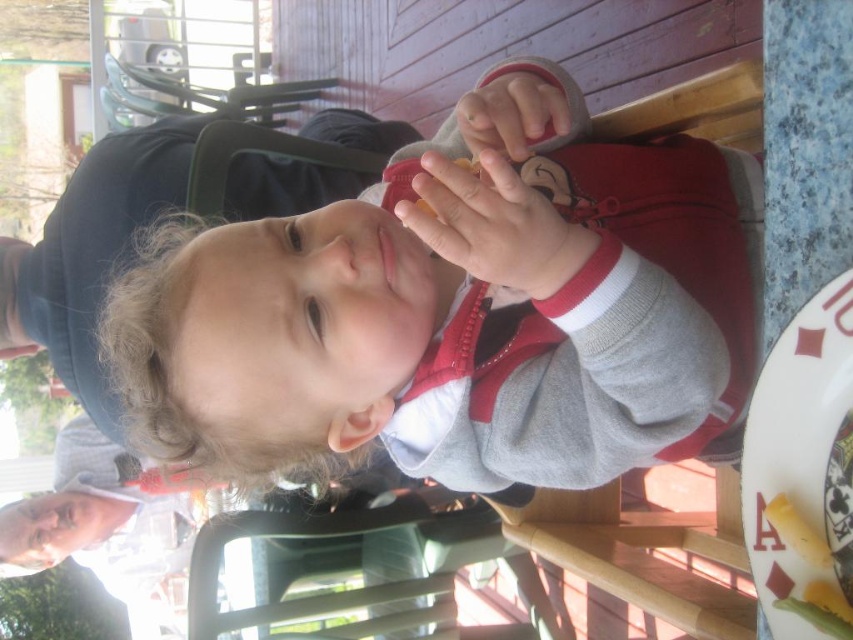
Question: Which point is farther to the camera?

Choices:
 (A) smooth skin hand at center
 (B) white glossy plate at lower right
 (C) matte plastic phone at upper center
 (D) gray fleece jacket at center

Answer: (C)

Question: Can you confirm if gray fleece jacket at center is positioned below yellow matte corn at lower right?

Choices:
 (A) no
 (B) yes

Answer: (A)

Question: Is white glossy plate at lower right closer to the viewer compared to yellow matte corn at lower right?

Choices:
 (A) yes
 (B) no

Answer: (A)

Question: Which of the following is the farthest from the observer?

Choices:
 (A) matte plastic phone at upper center
 (B) yellow matte corn at lower right
 (C) gray fleece jacket at center
 (D) white glossy plate at lower right

Answer: (A)

Question: Which point appears farthest from the camera in this image?

Choices:
 (A) (801, 554)
 (B) (445, 205)
 (C) (669, 182)
 (D) (796, 534)

Answer: (C)

Question: Does smooth skin hand at center appear on the right side of matte plastic phone at upper center?

Choices:
 (A) yes
 (B) no

Answer: (B)